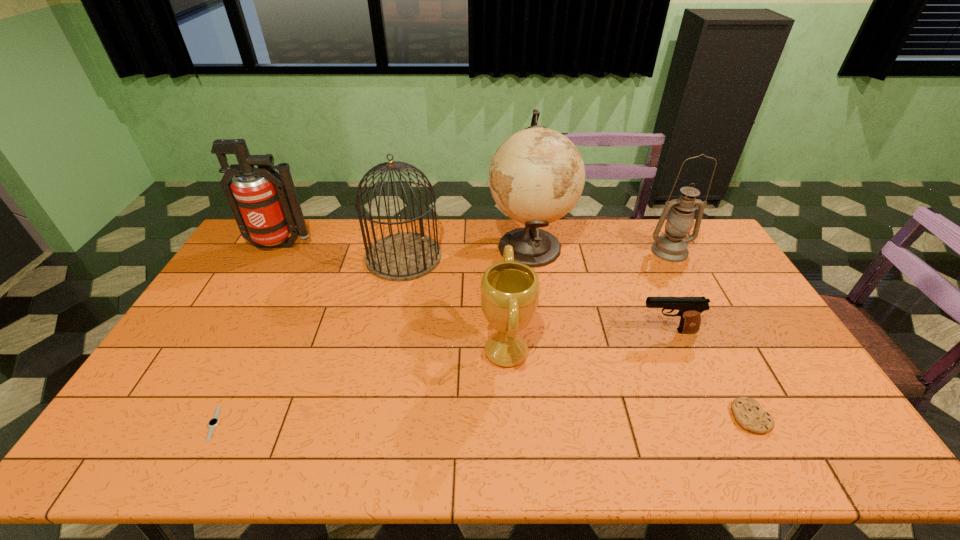
Identify the location of object identified as the fifth closest to the fire extinguisher. The height and width of the screenshot is (540, 960). (690, 308).

This screenshot has width=960, height=540. I want to click on vacant point that satisfies the following two spatial constraints: 1. on the front-facing side of the globe; 2. on the left side of the cookie, so click(553, 417).

The width and height of the screenshot is (960, 540). Identify the location of free location that satisfies the following two spatial constraints: 1. on the front-facing side of the globe; 2. on the left side of the cookie. (553, 417).

You are a GUI agent. You are given a task and a screenshot of the screen. Output one action in this format:
    pyautogui.click(x=<x>, y=<y>)
    Task: Click on the vacant point that satisfies the following two spatial constraints: 1. on the back side of the watch; 2. on the left side of the second shortest object
    This screenshot has height=540, width=960.
    Given the screenshot: What is the action you would take?
    pyautogui.click(x=217, y=417)

Where is `vacant point that satisfies the following two spatial constraints: 1. on the back side of the oil lamp; 2. on the front-facing side of the globe`? The height and width of the screenshot is (540, 960). vacant point that satisfies the following two spatial constraints: 1. on the back side of the oil lamp; 2. on the front-facing side of the globe is located at coordinates (667, 246).

At what (x,y) coordinates should I click in order to perform the action: click on free location that satisfies the following two spatial constraints: 1. on the back side of the oil lamp; 2. on the left side of the seventh tallest object. Please return your answer as a coordinate pair (x, y). The width and height of the screenshot is (960, 540). Looking at the image, I should click on pos(665,251).